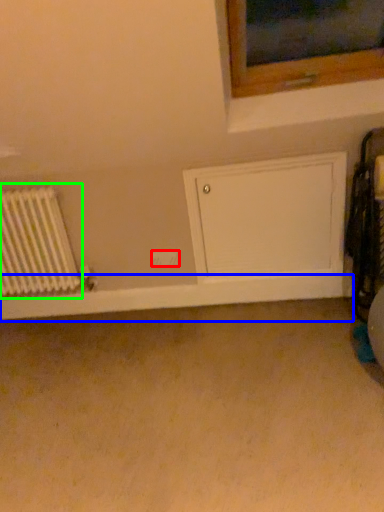
Question: Which object is positioned farthest from electric outlet (highlighted by a red box)? Select from window sill (highlighted by a blue box) and radiator (highlighted by a green box).

Choices:
 (A) window sill
 (B) radiator

Answer: (B)